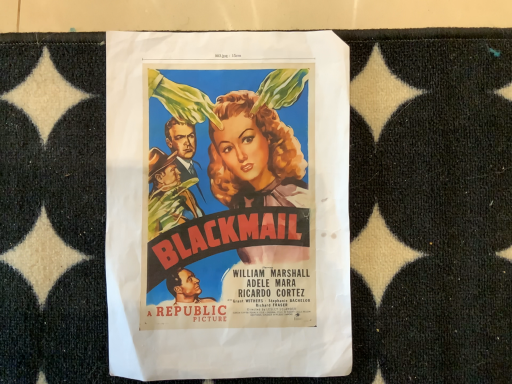
I want to click on matte paper poster at center, so click(228, 205).

In order to face matte paper poster at center, should I rotate leftwards or rightwards?

Rotate left and turn 3.972 degrees.

The width and height of the screenshot is (512, 384). What do you see at coordinates (228, 205) in the screenshot?
I see `matte paper poster at center` at bounding box center [228, 205].

The height and width of the screenshot is (384, 512). I want to click on matte paper poster at center, so click(228, 205).